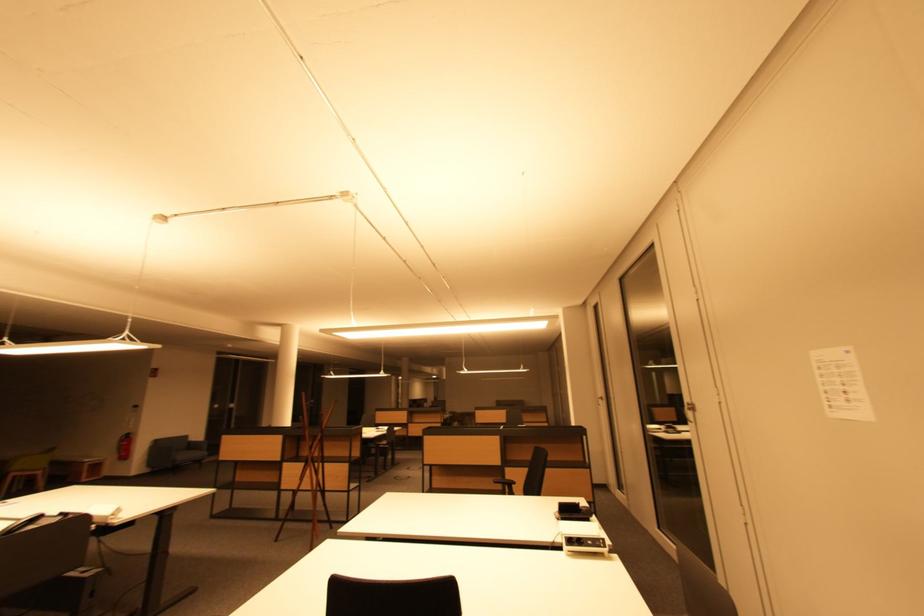
The height and width of the screenshot is (616, 924). I want to click on sofa sitting surface, so click(x=179, y=459).